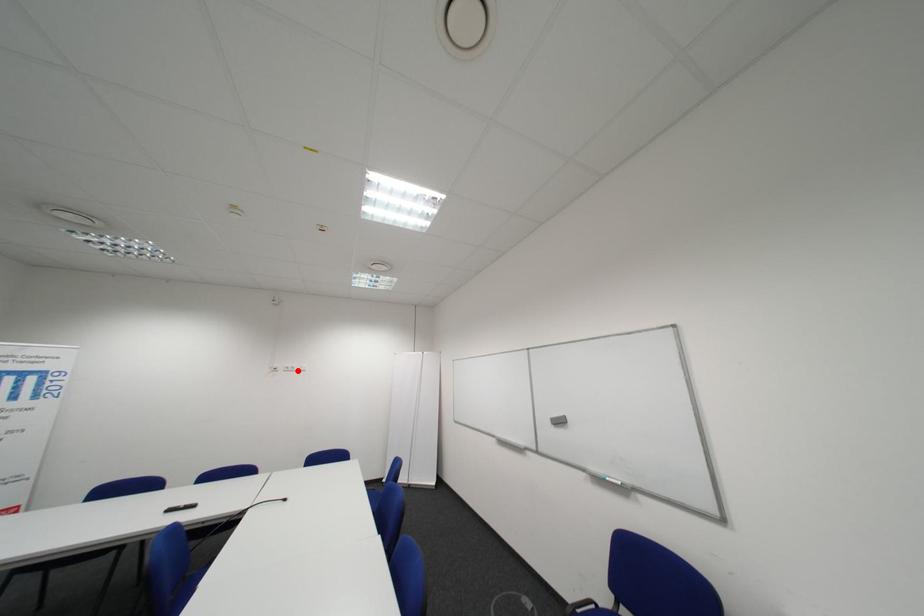
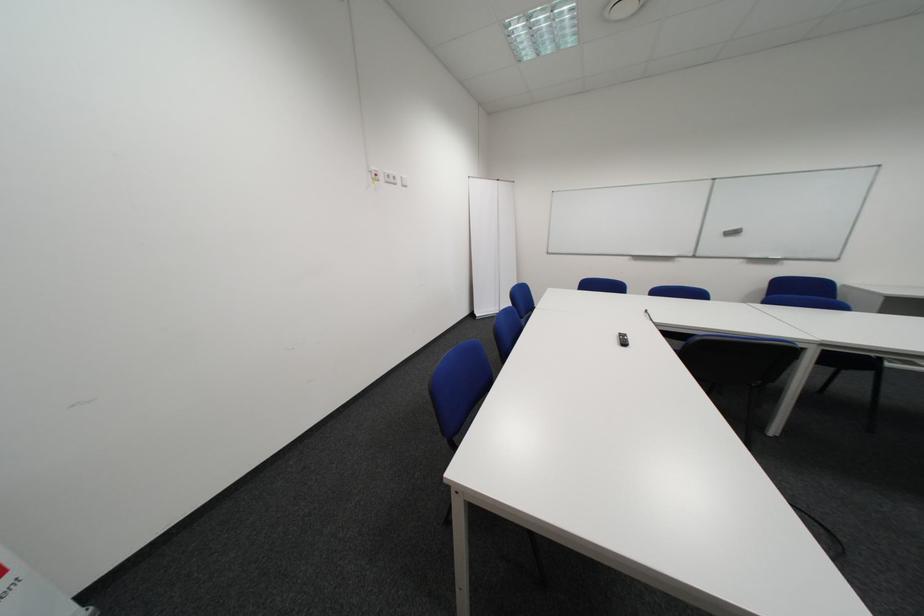
The point at the highlighted location is marked in the first image. Where is the corresponding point in the second image?

(398, 180)